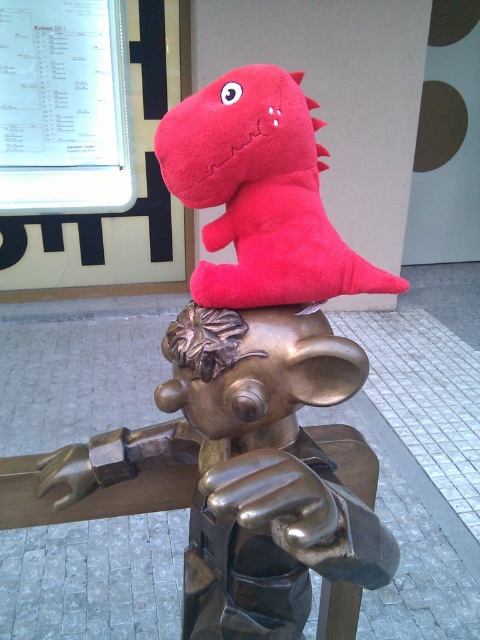
You are a delivery person who needs to place a small package on the bronze statue at center without knocking over the matte plush dinosaur at upper center. Considering their sizes, can you safely place the package between them?

The bronze statue at center is wider than the matte plush dinosaur at upper center, so placing the package between them should be safe as there is enough space between their widths.